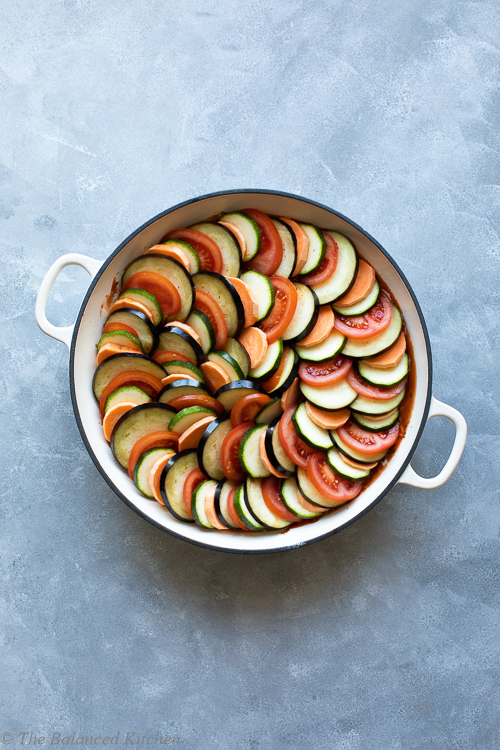
Identify the location of white pot handles. (43, 292), (454, 460).